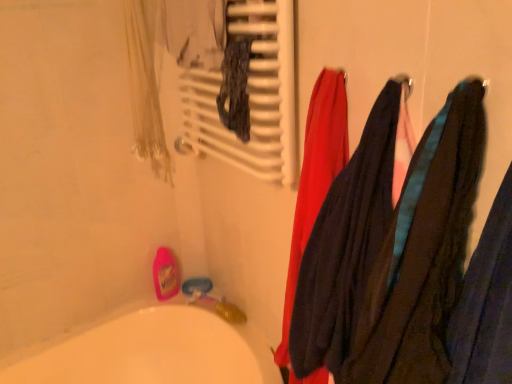
Question: From the image's perspective, is white matte radiator at upper center located above or below dark blue fabric at right?

Choices:
 (A) below
 (B) above

Answer: (B)

Question: Is white matte radiator at upper center to the left or to the right of dark blue fabric at right in the image?

Choices:
 (A) left
 (B) right

Answer: (A)

Question: Is white matte radiator at upper center in front of or behind dark blue fabric at right in the image?

Choices:
 (A) behind
 (B) front

Answer: (A)

Question: Visually, is dark blue fabric at right positioned to the left or to the right of white matte radiator at upper center?

Choices:
 (A) right
 (B) left

Answer: (A)

Question: Based on their sizes in the image, would you say dark blue fabric at right is bigger or smaller than white matte radiator at upper center?

Choices:
 (A) big
 (B) small

Answer: (B)

Question: Looking at their shapes, would you say dark blue fabric at right is wider or thinner than white matte radiator at upper center?

Choices:
 (A) wide
 (B) thin

Answer: (A)

Question: From the image's perspective, is dark blue fabric at right positioned above or below white matte radiator at upper center?

Choices:
 (A) above
 (B) below

Answer: (B)